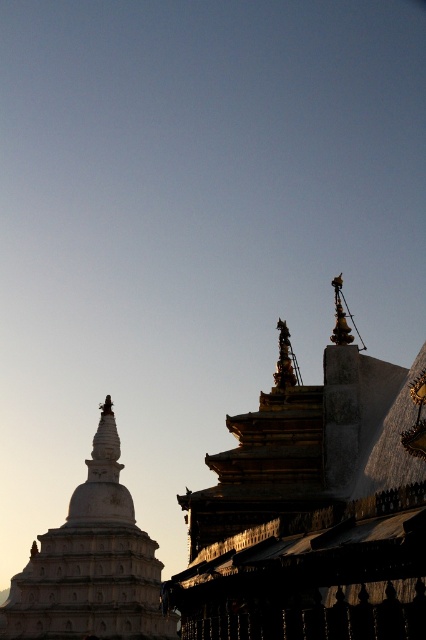
Question: Is gold/gilded stone temple at upper center to the left of white stupa at left from the viewer's perspective?

Choices:
 (A) no
 (B) yes

Answer: (A)

Question: Is gold/gilded stone temple at upper center to the right of white stupa at left from the viewer's perspective?

Choices:
 (A) no
 (B) yes

Answer: (B)

Question: Can you confirm if gold/gilded stone temple at upper center is thinner than white stupa at left?

Choices:
 (A) no
 (B) yes

Answer: (B)

Question: Which point appears farthest from the camera in this image?

Choices:
 (A) (244, 483)
 (B) (52, 541)

Answer: (B)

Question: Which point is farther from the camera taking this photo?

Choices:
 (A) (423, 384)
 (B) (132, 522)

Answer: (B)